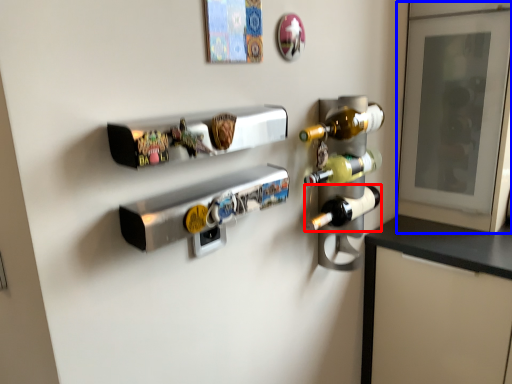
Question: Which of the following is the closest to the observer, bottle (highlighted by a red box) or glass door (highlighted by a blue box)?

Choices:
 (A) bottle
 (B) glass door

Answer: (A)